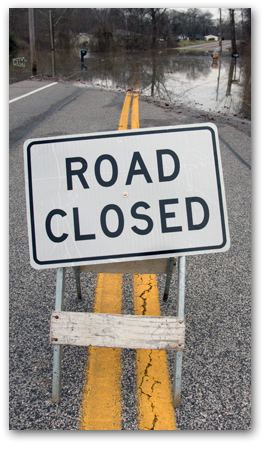
Where is `wood board`? wood board is located at coordinates (136, 329), (155, 263).